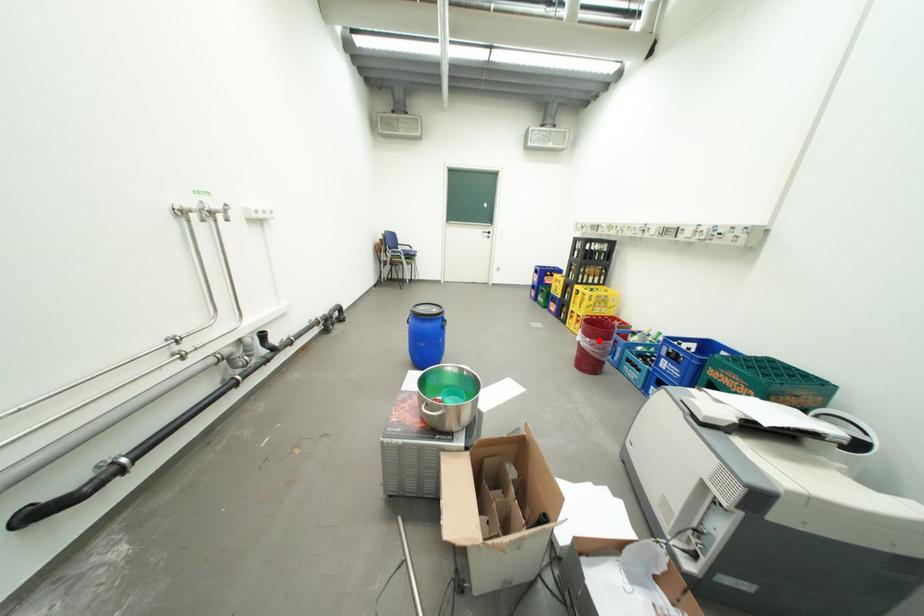
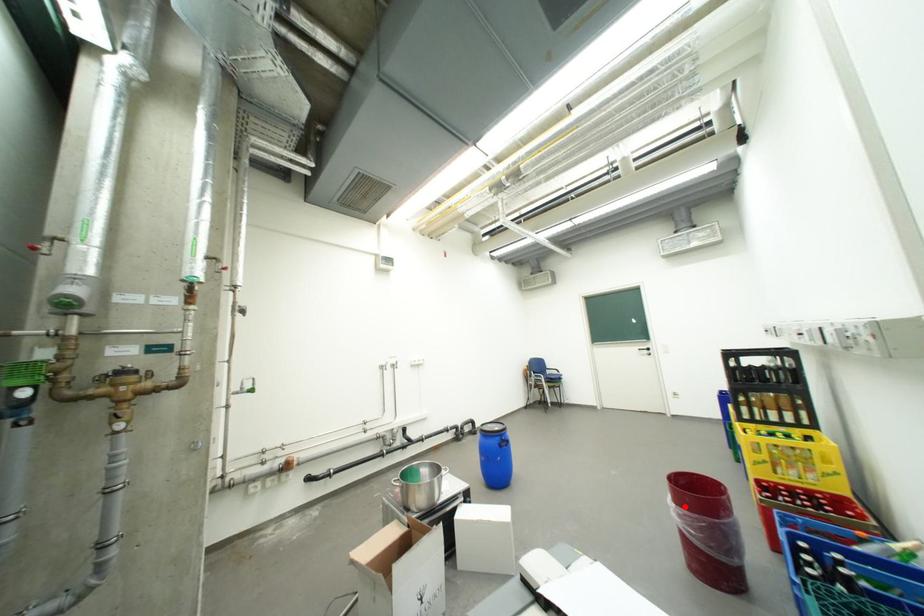
I am providing you with two images of the same scene from different viewpoints. A red point is marked on the first image and another point is marked on the second image. Are the points marked in image1 and image2 representing the same 3D position?

Yes